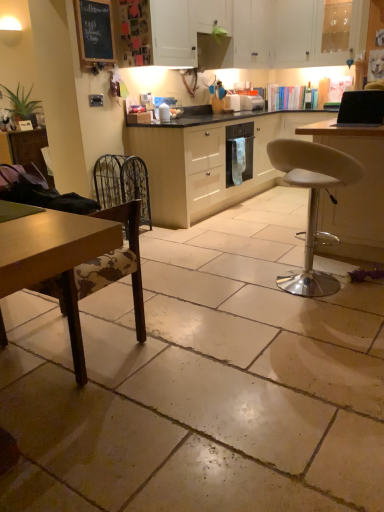
The image size is (384, 512). I want to click on free space in front of wooden chair at lower left, placed as the second chair when sorted from right to left, so click(x=70, y=409).